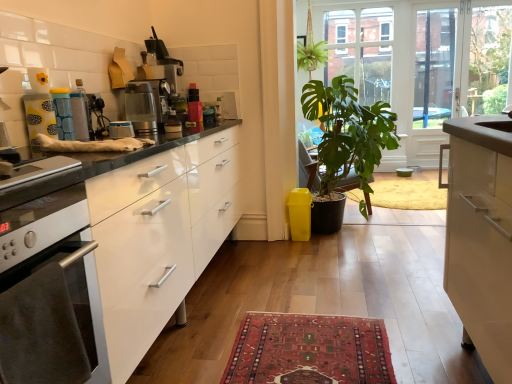
Image resolution: width=512 pixels, height=384 pixels. What are the coordinates of `free space in front of yellow plastic trash bin/can at lower right` in the screenshot? It's located at (305, 241).